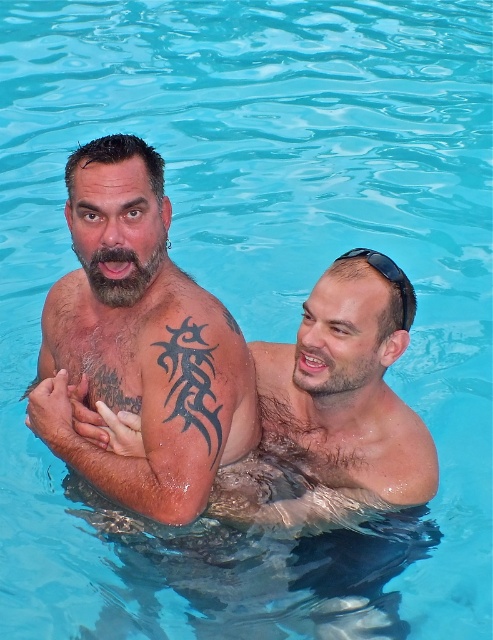
Question: Which point is farther from the camera taking this photo?

Choices:
 (A) (249, 412)
 (B) (390, 273)

Answer: (A)

Question: Does dark brown skin tattoo at center have a lesser width compared to black rubber goggles at upper right?

Choices:
 (A) yes
 (B) no

Answer: (B)

Question: From the image, what is the correct spatial relationship of dark brown skin tattoo at center in relation to black rubber goggles at upper right?

Choices:
 (A) below
 (B) above

Answer: (A)

Question: In this image, where is dark brown skin tattoo at center located relative to black rubber goggles at upper right?

Choices:
 (A) below
 (B) above

Answer: (A)